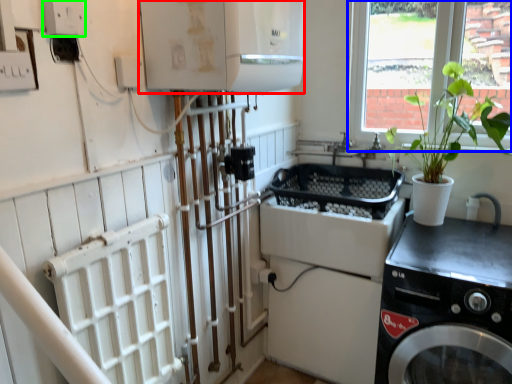
Question: Which object is the closest to the appliance (highlighted by a red box)? Choose among these: window (highlighted by a blue box) or electric outlet (highlighted by a green box).

Choices:
 (A) window
 (B) electric outlet

Answer: (B)